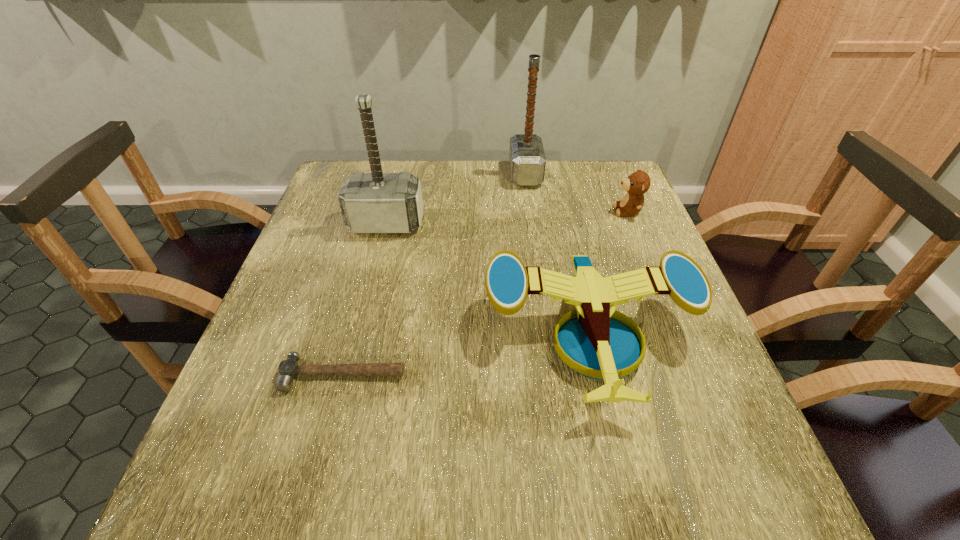
Locate an element on the screen. The width and height of the screenshot is (960, 540). the farthest object is located at coordinates (527, 160).

The height and width of the screenshot is (540, 960). Find the location of `the farthest hammer`. the farthest hammer is located at coordinates (527, 160).

At what (x,y) coordinates should I click in order to perform the action: click on the second farthest hammer. Please return your answer as a coordinate pair (x, y). This screenshot has height=540, width=960. Looking at the image, I should click on (376, 202).

What are the coordinates of `drone` in the screenshot? It's located at (593, 344).

Locate an element on the screen. The height and width of the screenshot is (540, 960). teddy bear is located at coordinates (638, 183).

This screenshot has width=960, height=540. Find the location of `the nearest hammer`. the nearest hammer is located at coordinates (288, 369).

Locate an element on the screen. The width and height of the screenshot is (960, 540). the shortest hammer is located at coordinates (288, 369).

This screenshot has width=960, height=540. What are the coordinates of `vacant position located 0.180m on the striking surface of the farthest object` in the screenshot? It's located at (449, 174).

Identify the location of vacant space located 0.150m on the striking surface of the farthest object. The height and width of the screenshot is (540, 960). (460, 174).

In order to click on free region located 0.300m on the striking surface of the farthest object in this screenshot , I will do `click(409, 174)`.